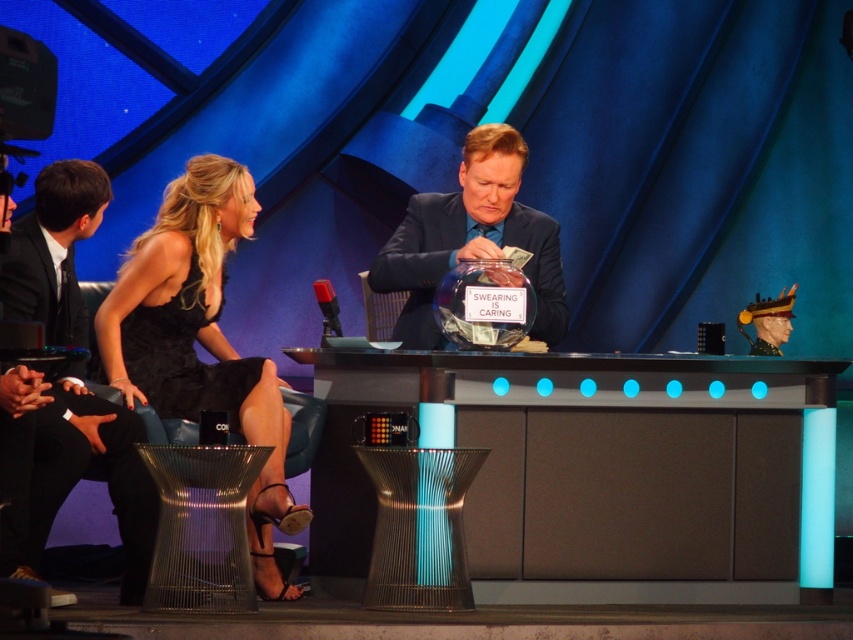
Question: Which point is farther to the camera?

Choices:
 (A) black satin dress at center
 (B) black satin dress at left
 (C) shiny black suit at center

Answer: (C)

Question: Does black satin dress at center have a smaller size compared to shiny black suit at center?

Choices:
 (A) yes
 (B) no

Answer: (B)

Question: Which point is closer to the camera taking this photo?

Choices:
 (A) (144, 349)
 (B) (399, 285)
 (C) (24, 296)

Answer: (C)

Question: Where is black satin dress at center located in relation to shiny black suit at center in the image?

Choices:
 (A) below
 (B) above

Answer: (A)

Question: Is black satin dress at center smaller than shiny black suit at center?

Choices:
 (A) no
 (B) yes

Answer: (A)

Question: Which object is positioned farthest from the shiny black suit at center?

Choices:
 (A) black satin dress at center
 (B) black satin dress at left

Answer: (B)